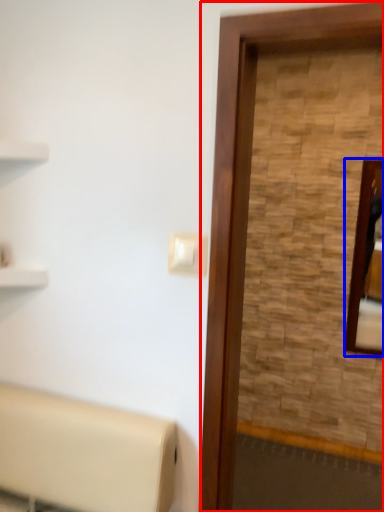
Question: Which point is closer to the camera, screen door (highlighted by a red box) or mirror (highlighted by a blue box)?

Choices:
 (A) screen door
 (B) mirror

Answer: (A)